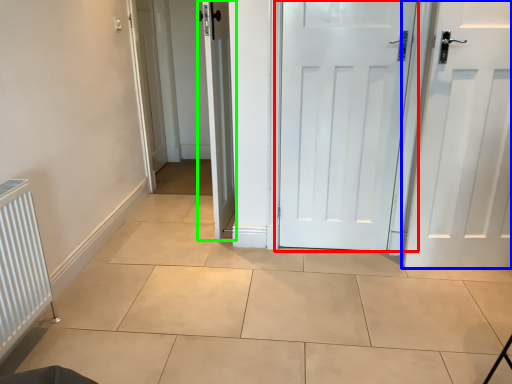
Question: Which object is positioned closest to door (highlighted by a red box)? Select from door (highlighted by a blue box) and door (highlighted by a green box).

Choices:
 (A) door
 (B) door

Answer: (A)